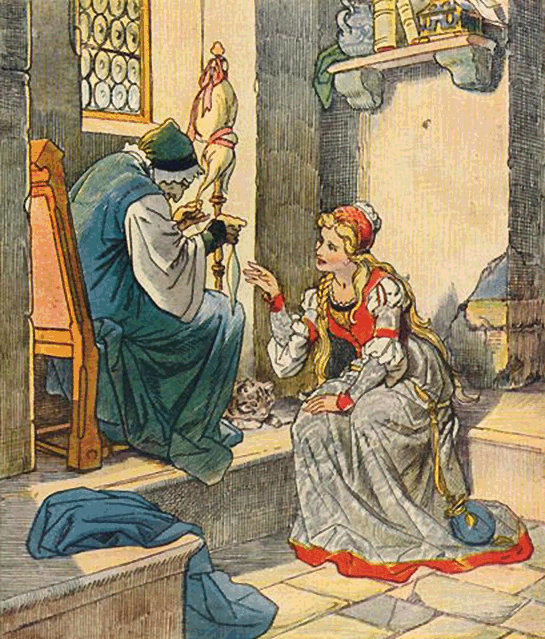
Where is `books`? books is located at coordinates (390, 26), (407, 6).